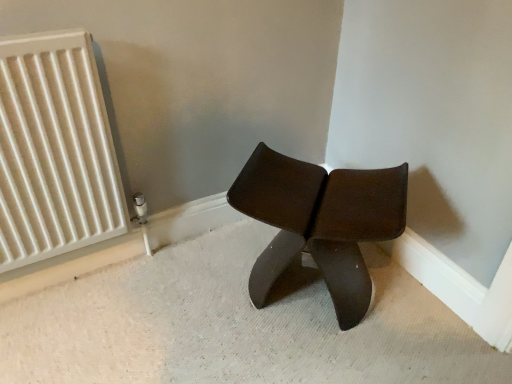
The image size is (512, 384). Find the location of `free space between white matte radiator at left and matte brown stool at center`. free space between white matte radiator at left and matte brown stool at center is located at coordinates pyautogui.click(x=178, y=289).